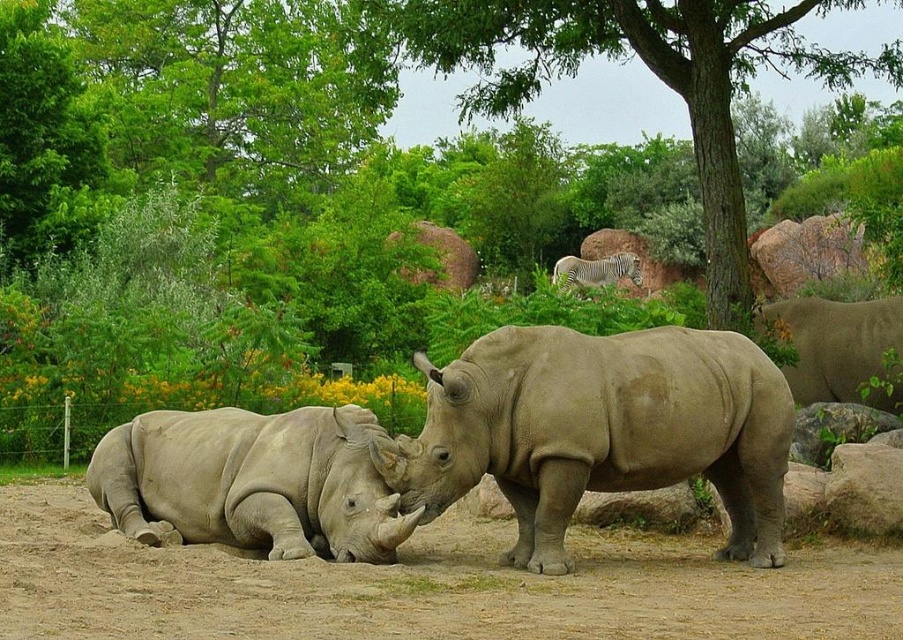
Can you confirm if green leafy tree at upper center is smaller than white striped zebra at upper center?

No, green leafy tree at upper center is not smaller than white striped zebra at upper center.

The width and height of the screenshot is (903, 640). I want to click on green leafy tree at upper center, so click(625, 60).

You are a GUI agent. You are given a task and a screenshot of the screen. Output one action in this format:
    pyautogui.click(x=<x>, y=<y>)
    Task: Click on the green leafy tree at upper center
    The height and width of the screenshot is (640, 903).
    Given the screenshot: What is the action you would take?
    pyautogui.click(x=625, y=60)

Can you confirm if gray matte rhinoceros at center is bigger than green leafy tree at upper center?

No.

Which of these two, gray matte rhinoceros at center or green leafy tree at upper center, stands taller?

With more height is green leafy tree at upper center.

Is point (739, 444) positioned after point (596, 26)?

No, (739, 444) is closer to viewer.

This screenshot has width=903, height=640. In order to click on gray matte rhinoceros at center in this screenshot , I will do `click(601, 429)`.

Based on the photo, between gray matte rhinoceros at right and white striped zebra at upper center, which one appears on the left side from the viewer's perspective?

white striped zebra at upper center

Is point (827, 326) closer to viewer compared to point (579, 262)?

Yes, it is in front of point (579, 262).

You are a GUI agent. You are given a task and a screenshot of the screen. Output one action in this format:
    pyautogui.click(x=<x>, y=<y>)
    Task: Click on the gray matte rhinoceros at right
    This screenshot has width=903, height=640.
    Given the screenshot: What is the action you would take?
    pyautogui.click(x=836, y=346)